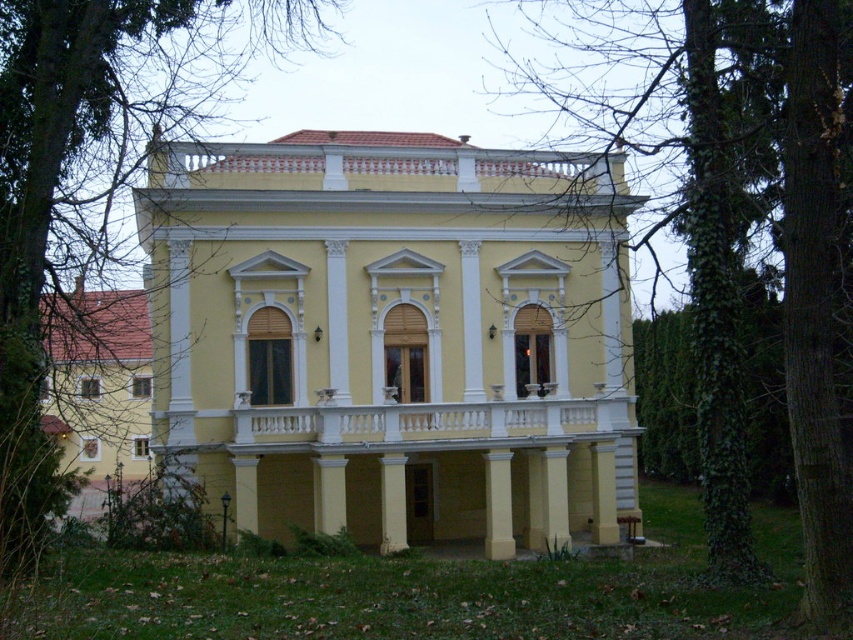
Question: Is yellow matte building at center wider than green ivy at center?

Choices:
 (A) yes
 (B) no

Answer: (A)

Question: Can you confirm if yellow matte building at center is smaller than green ivy at upper left?

Choices:
 (A) no
 (B) yes

Answer: (B)

Question: Which object appears farthest from the camera in this image?

Choices:
 (A) yellow matte building at center
 (B) green ivy at upper left

Answer: (A)

Question: Which point appears closest to the camera in this image?

Choices:
 (A) (781, 65)
 (B) (97, 92)

Answer: (A)

Question: Which object appears farthest from the camera in this image?

Choices:
 (A) green ivy at center
 (B) yellow matte building at center

Answer: (B)

Question: Can you confirm if green ivy at center is positioned below green ivy at upper left?

Choices:
 (A) no
 (B) yes

Answer: (B)